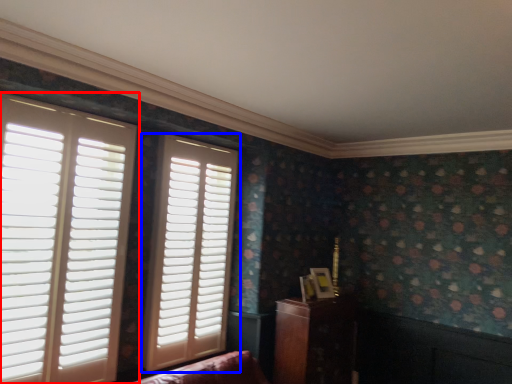
Question: Which object is closer to the camera taking this photo, window (highlighted by a red box) or window (highlighted by a blue box)?

Choices:
 (A) window
 (B) window

Answer: (A)